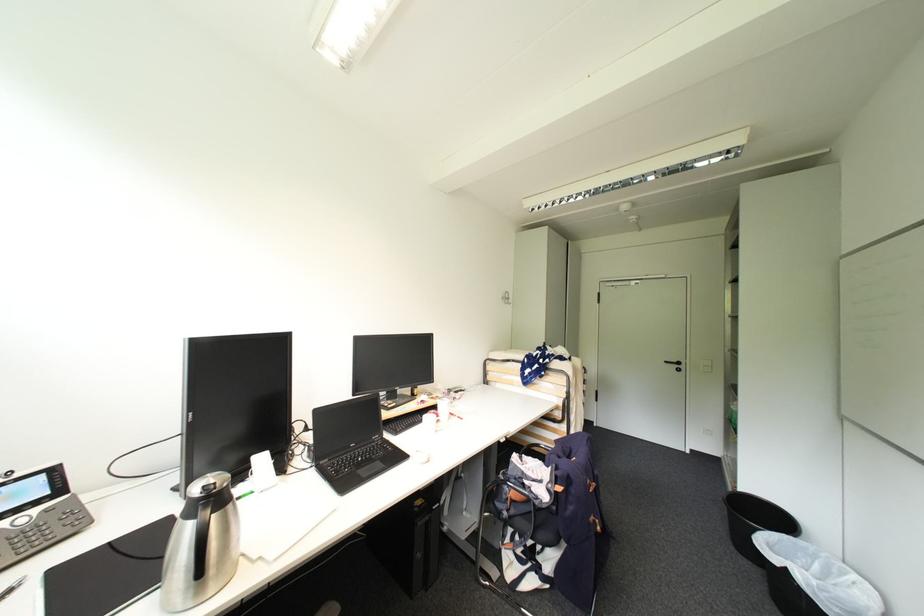
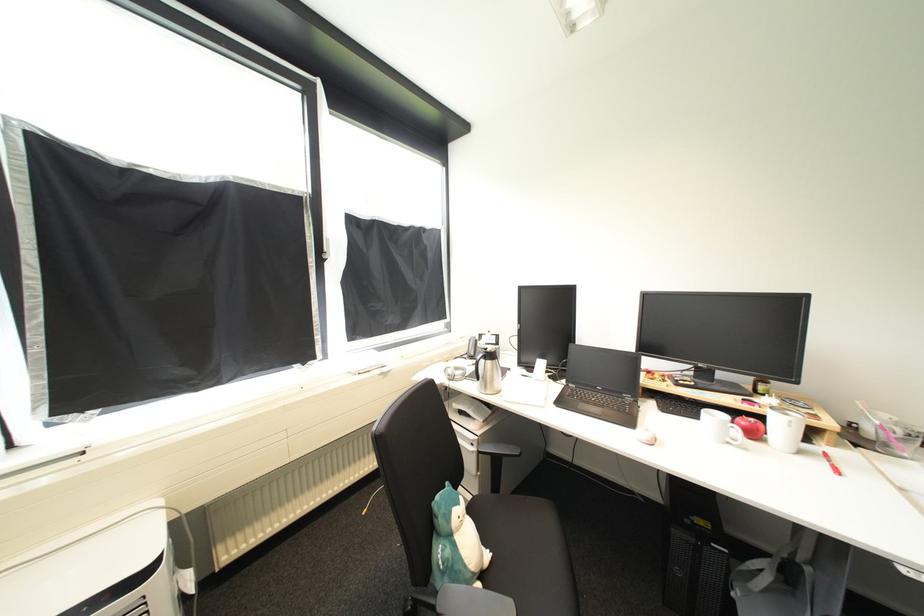
Where in the second image is the point corresponding to the point at 444,432 from the first image?

(736, 445)